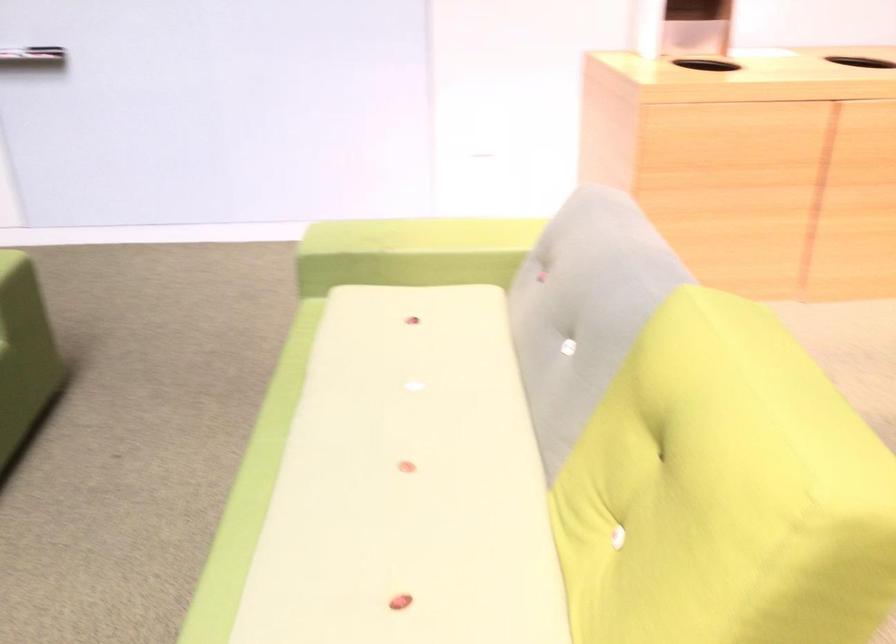
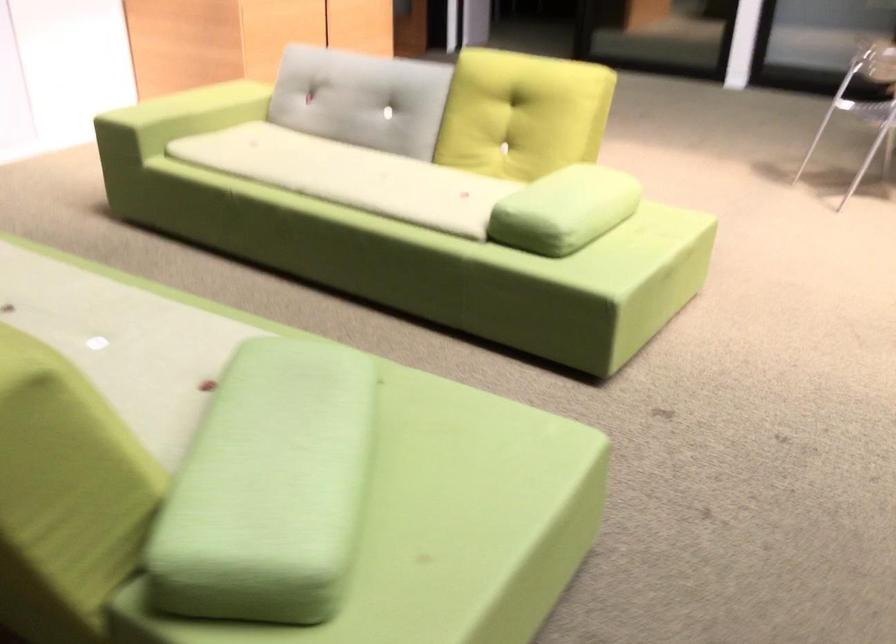
Find the pixel in the second image that matches pixel 346 447 in the first image.

(349, 176)